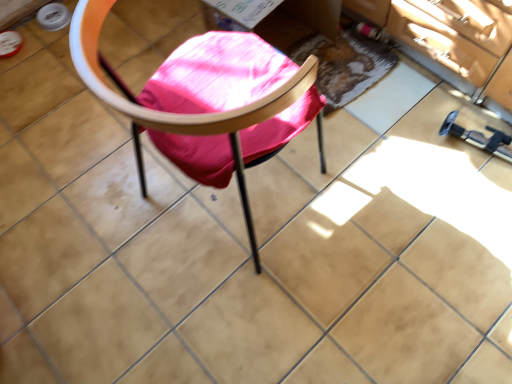
Where is `vacant space underneath wooden chair at center (from a real-world perspective)`? Image resolution: width=512 pixels, height=384 pixels. vacant space underneath wooden chair at center (from a real-world perspective) is located at coordinates (242, 203).